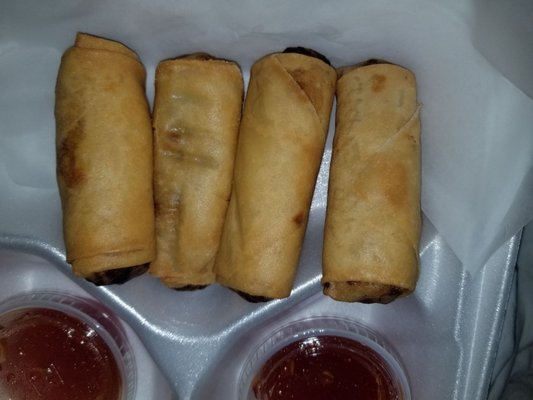
Where is `napkin`? This screenshot has height=400, width=533. napkin is located at coordinates (487, 234).